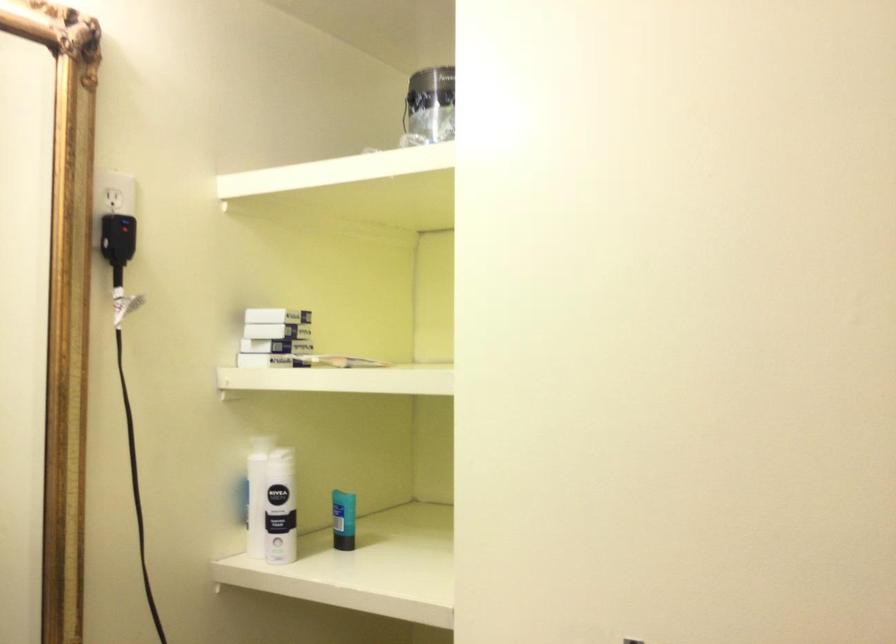
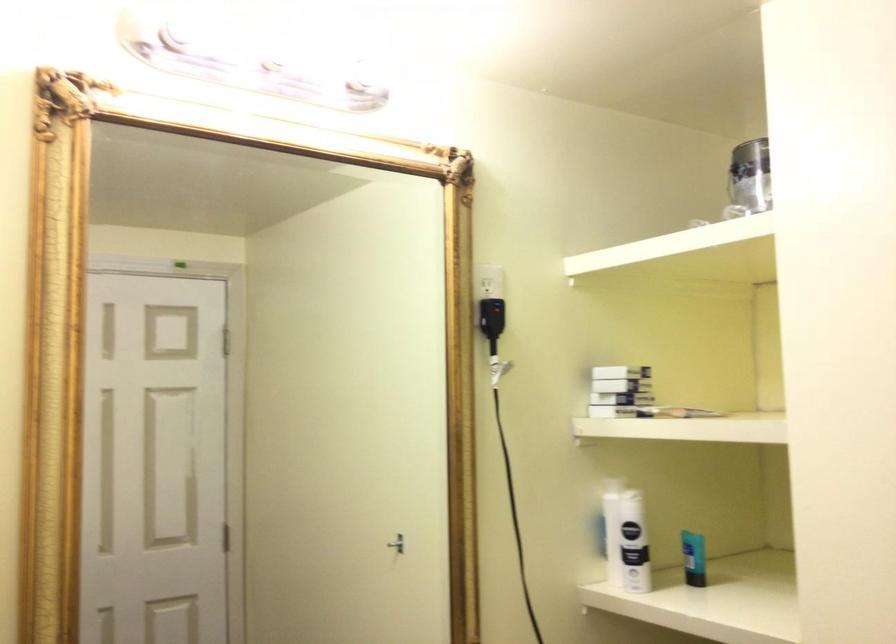
In the second image, find the point that corresponds to pixel 262 330 in the first image.

(617, 386)